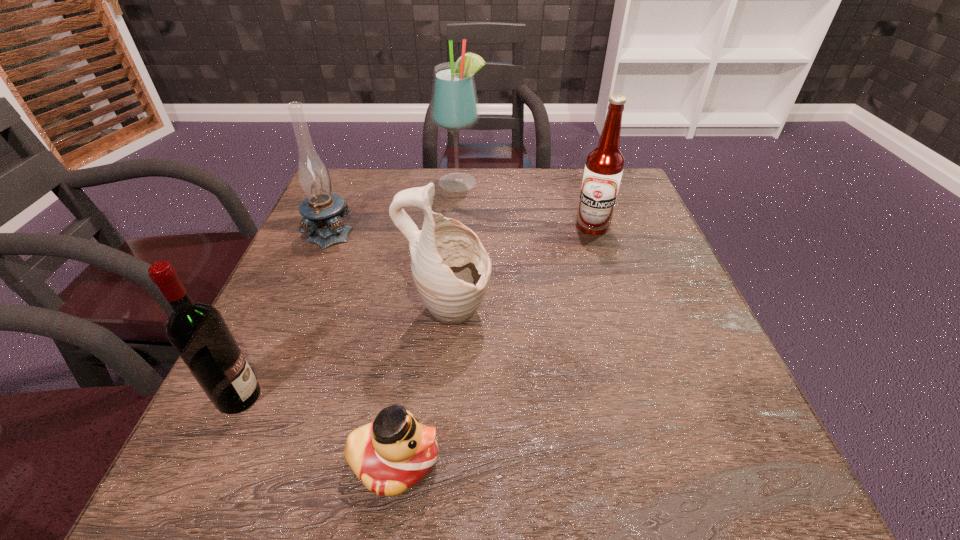
In order to click on the farthest alcohol in this screenshot , I will do `click(454, 108)`.

This screenshot has width=960, height=540. I want to click on the second alcohol from left to right, so click(x=454, y=108).

Where is `oil lamp`? oil lamp is located at coordinates (320, 209).

Find the location of a particular element. the rightmost alcohol is located at coordinates (604, 165).

You are a GUI agent. You are given a task and a screenshot of the screen. Output one action in this format:
    pyautogui.click(x=<x>, y=<y>)
    Task: Click on the rightmost object
    This screenshot has width=960, height=540.
    Given the screenshot: What is the action you would take?
    pyautogui.click(x=604, y=165)

Where is `the third nearest object`? The height and width of the screenshot is (540, 960). the third nearest object is located at coordinates (451, 269).

You are a GUI agent. You are given a task and a screenshot of the screen. Output one action in this format:
    pyautogui.click(x=<x>, y=<y>)
    Task: Click on the fifth farthest object
    
    Given the screenshot: What is the action you would take?
    pyautogui.click(x=198, y=332)

The image size is (960, 540). I want to click on the leftmost alcohol, so click(x=198, y=332).

Identify the location of duck. This screenshot has width=960, height=540. (394, 452).

The height and width of the screenshot is (540, 960). I want to click on the shortest object, so click(394, 452).